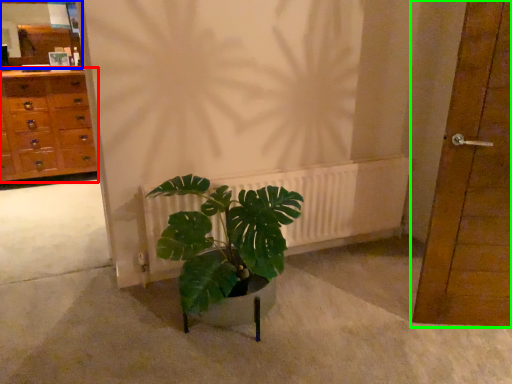
Question: Estimate the real-world distances between objects in this image. Which object is farther from chest of drawers (highlighted by a red box), mirror (highlighted by a blue box) or door (highlighted by a green box)?

Choices:
 (A) mirror
 (B) door

Answer: (B)